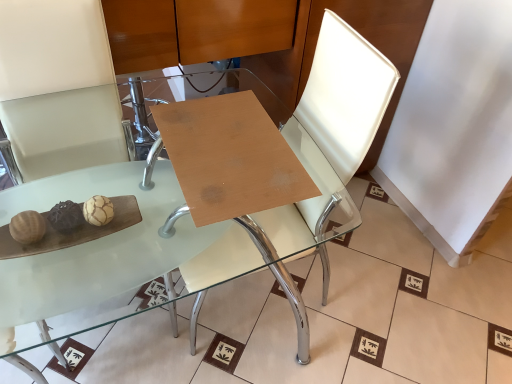
The width and height of the screenshot is (512, 384). I want to click on vacant space to the right of transparent glass table at center, which ranks as the 2th table in back-to-front order, so click(388, 293).